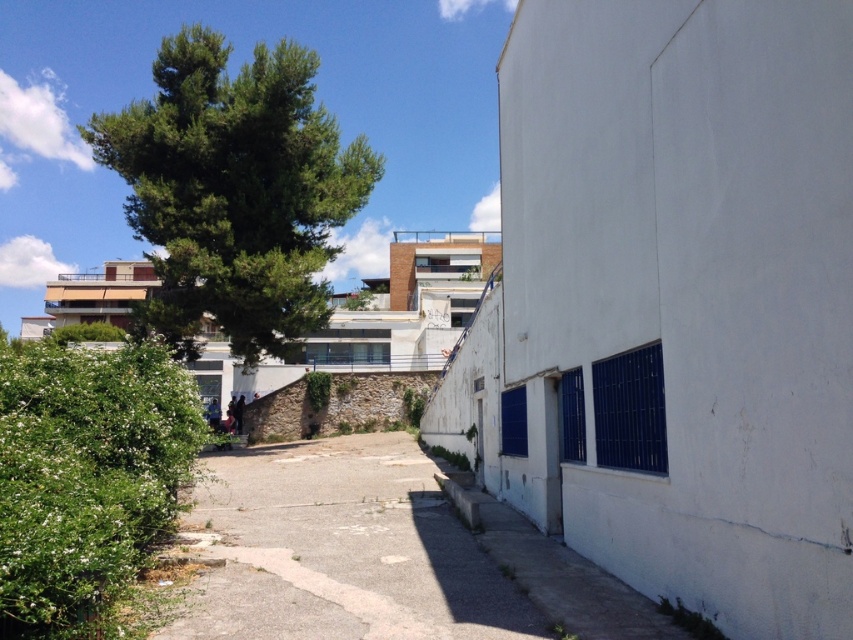
Question: Which object is positioned farthest from the green leafy bush at left?

Choices:
 (A) green leafy tree at upper left
 (B) gray concrete path at lower left

Answer: (A)

Question: Which of the following is the farthest from the observer?

Choices:
 (A) green leafy tree at upper left
 (B) green leafy bush at left

Answer: (A)

Question: Can you confirm if gray concrete path at lower left is bigger than green leafy bush at left?

Choices:
 (A) yes
 (B) no

Answer: (B)

Question: Among these objects, which one is nearest to the camera?

Choices:
 (A) green leafy tree at upper left
 (B) gray concrete path at lower left
 (C) green leafy bush at left

Answer: (C)

Question: Is green leafy tree at upper left in front of gray concrete path at lower left?

Choices:
 (A) yes
 (B) no

Answer: (B)

Question: Considering the relative positions of green leafy tree at upper left and gray concrete path at lower left in the image provided, where is green leafy tree at upper left located with respect to gray concrete path at lower left?

Choices:
 (A) left
 (B) right

Answer: (A)